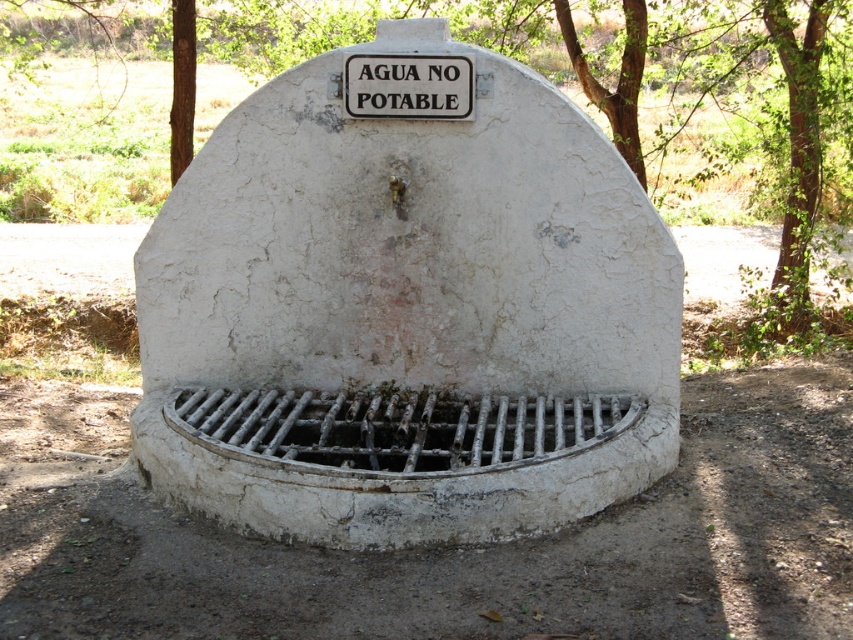
Question: Which point is farther to the camera?

Choices:
 (A) (550, 420)
 (B) (397, 90)

Answer: (A)

Question: Does green leafy tree at upper center appear over rusty metal grate at center?

Choices:
 (A) no
 (B) yes

Answer: (B)

Question: Which object is farther from the camera taking this photo?

Choices:
 (A) green leafy tree at upper center
 (B) rusty metal grate at center

Answer: (A)

Question: Can you confirm if green leafy tree at upper center is thinner than rusty metal grate at center?

Choices:
 (A) yes
 (B) no

Answer: (B)

Question: Which point is closer to the camera taking this photo?

Choices:
 (A) (361, 52)
 (B) (341, 394)
 (C) (799, 104)

Answer: (A)

Question: Observing the image, what is the correct spatial positioning of rusty metal grate at center in reference to white plastic sign at upper center?

Choices:
 (A) below
 (B) above

Answer: (A)